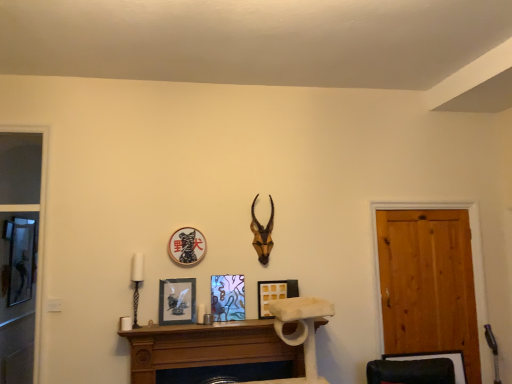
Question: Is metallic glass picture frame at center, placed as the 3th picture frame when sorted from left to right, shorter than black matte picture frame at center, the 3th picture frame when ordered from right to left?

Choices:
 (A) yes
 (B) no

Answer: (B)

Question: Is metallic glass picture frame at center, marked as the second picture frame in a right-to-left arrangement, thinner than black matte picture frame at center, the 3th picture frame when ordered from right to left?

Choices:
 (A) yes
 (B) no

Answer: (A)

Question: Is metallic glass picture frame at center, placed as the 3th picture frame when sorted from left to right, positioned far away from black matte picture frame at center, which appears as the second picture frame when viewed from the left?

Choices:
 (A) yes
 (B) no

Answer: (B)

Question: Considering the relative sizes of metallic glass picture frame at center, placed as the 3th picture frame when sorted from left to right, and black matte picture frame at center, which appears as the second picture frame when viewed from the left, in the image provided, is metallic glass picture frame at center, placed as the 3th picture frame when sorted from left to right, bigger than black matte picture frame at center, which appears as the second picture frame when viewed from the left,?

Choices:
 (A) no
 (B) yes

Answer: (A)

Question: Does metallic glass picture frame at center, marked as the second picture frame in a right-to-left arrangement, appear on the left side of black matte picture frame at center, the 3th picture frame when ordered from right to left?

Choices:
 (A) no
 (B) yes

Answer: (A)

Question: Do you think metallic glass picture frame at center, marked as the second picture frame in a right-to-left arrangement, is within brown wooden antler at upper center, or outside of it?

Choices:
 (A) outside
 (B) inside

Answer: (A)

Question: Based on their sizes in the image, would you say metallic glass picture frame at center, marked as the second picture frame in a right-to-left arrangement, is bigger or smaller than brown wooden antler at upper center?

Choices:
 (A) big
 (B) small

Answer: (B)

Question: From the image's perspective, is metallic glass picture frame at center, placed as the 3th picture frame when sorted from left to right, above or below brown wooden antler at upper center?

Choices:
 (A) above
 (B) below

Answer: (B)

Question: Is metallic glass picture frame at center, marked as the second picture frame in a right-to-left arrangement, in front of or behind brown wooden antler at upper center in the image?

Choices:
 (A) behind
 (B) front

Answer: (B)

Question: Considering the positions of point (258, 236) and point (178, 354), is point (258, 236) closer or farther from the camera than point (178, 354)?

Choices:
 (A) closer
 (B) farther

Answer: (B)

Question: From a real-world perspective, is brown wooden antler at upper center above or below brown wooden fireplace at center?

Choices:
 (A) above
 (B) below

Answer: (A)

Question: Is brown wooden antler at upper center inside or outside of brown wooden fireplace at center?

Choices:
 (A) inside
 (B) outside

Answer: (B)

Question: Visually, is brown wooden antler at upper center positioned to the left or to the right of brown wooden fireplace at center?

Choices:
 (A) left
 (B) right

Answer: (B)

Question: From a real-world perspective, is brown wooden antler at upper center physically located above or below matte black picture frame at center, the fourth picture frame in the right-to-left sequence?

Choices:
 (A) below
 (B) above

Answer: (B)

Question: Relative to matte black picture frame at center, which is counted as the 1th picture frame, starting from the left, is brown wooden antler at upper center in front or behind?

Choices:
 (A) front
 (B) behind

Answer: (B)